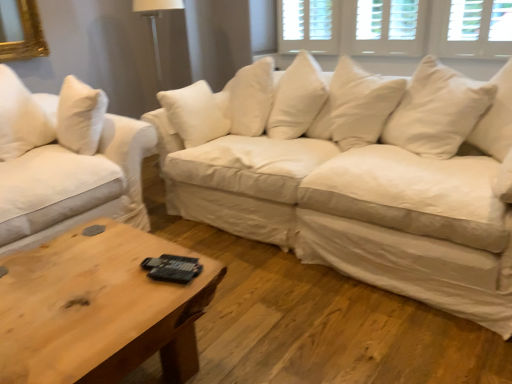
Locate an element on the screen. This screenshot has width=512, height=384. white wood blinds at upper center, the 1th window in the right-to-left sequence is located at coordinates (384, 27).

This screenshot has height=384, width=512. What do you see at coordinates (66, 162) in the screenshot? I see `white cotton couch at left, which is counted as the 2th studio couch, starting from the right` at bounding box center [66, 162].

What are the coordinates of `white cotton couch at center, which is counted as the 1th studio couch, starting from the right` in the screenshot? It's located at (360, 178).

How much space does white cotton couch at center, the 2th studio couch when ordered from left to right, occupy vertically?

It is 31.88 inches.

What do you see at coordinates (98, 308) in the screenshot? I see `wooden rustic coffee table at center` at bounding box center [98, 308].

I want to click on white wood window at upper center, the second window when ordered from right to left, so click(x=308, y=26).

Is white wood window at upper center, the second window when ordered from right to left, looking in the opposite direction of white cotton couch at left, which is counted as the 2th studio couch, starting from the right?

That's not correct — white wood window at upper center, the second window when ordered from right to left, is not looking away from white cotton couch at left, which is counted as the 2th studio couch, starting from the right.

Is point (332, 42) positioned in front of point (6, 240)?

No, (332, 42) is behind (6, 240).

Which object is wider, white wood window at upper center, the second window when ordered from right to left, or white cotton couch at left, the 1th studio couch in the left-to-right sequence?

white cotton couch at left, the 1th studio couch in the left-to-right sequence, is wider.

From their relative heights in the image, would you say white wood window at upper center, the second window when ordered from right to left, is taller or shorter than white cotton couch at left, the 1th studio couch in the left-to-right sequence?

Clearly, white wood window at upper center, the second window when ordered from right to left, is shorter compared to white cotton couch at left, the 1th studio couch in the left-to-right sequence.

From a real-world perspective, who is located higher, white wood blinds at upper center, the 1th window in the right-to-left sequence, or white cotton couch at center, which is counted as the 1th studio couch, starting from the right?

white wood blinds at upper center, the 1th window in the right-to-left sequence, from a real-world perspective.

Choose the correct answer: Is white wood blinds at upper center, which ranks as the second window in left-to-right order, inside white cotton couch at center, which is counted as the 1th studio couch, starting from the right, or outside it?

white wood blinds at upper center, which ranks as the second window in left-to-right order, is not inside white cotton couch at center, which is counted as the 1th studio couch, starting from the right, it's outside.

From the image's perspective, is white wood blinds at upper center, which ranks as the second window in left-to-right order, located above or below white cotton couch at center, the 2th studio couch when ordered from left to right?

Clearly, from the image's perspective, white wood blinds at upper center, which ranks as the second window in left-to-right order, is above white cotton couch at center, the 2th studio couch when ordered from left to right.

Visually, is white cotton couch at center, the 2th studio couch when ordered from left to right, positioned to the left or to the right of white wood window at upper center, the first window from the left?

white cotton couch at center, the 2th studio couch when ordered from left to right, is positioned on white wood window at upper center, the first window from the left,'s left side.

This screenshot has width=512, height=384. Find the location of `the 2nd window above the white cotton couch at center, which is counted as the 1th studio couch, starting from the right (from a real-world perspective)`. the 2nd window above the white cotton couch at center, which is counted as the 1th studio couch, starting from the right (from a real-world perspective) is located at coordinates (308, 26).

From a real-world perspective, who is located lower, white cotton couch at center, which is counted as the 1th studio couch, starting from the right, or white wood window at upper center, the first window from the left?

From a 3D spatial view, white cotton couch at center, which is counted as the 1th studio couch, starting from the right, is below.

Does white cotton couch at left, the 1th studio couch in the left-to-right sequence, have a smaller size compared to white wood window at upper center, the second window when ordered from right to left?

Incorrect, white cotton couch at left, the 1th studio couch in the left-to-right sequence, is not smaller in size than white wood window at upper center, the second window when ordered from right to left.

Considering the relative sizes of white cotton couch at left, which is counted as the 2th studio couch, starting from the right, and white wood window at upper center, the first window from the left, in the image provided, is white cotton couch at left, which is counted as the 2th studio couch, starting from the right, taller than white wood window at upper center, the first window from the left,?

Yes.

At what (x,y) coordinates should I click in order to perform the action: click on the 2nd window behind the white cotton couch at left, the 1th studio couch in the left-to-right sequence. Please return your answer as a coordinate pair (x, y). Looking at the image, I should click on (308, 26).

Is white cotton couch at left, which is counted as the 2th studio couch, starting from the right, oriented away from white wood window at upper center, the first window from the left?

white cotton couch at left, which is counted as the 2th studio couch, starting from the right, is not turned away from white wood window at upper center, the first window from the left.

Can you tell me how much white wood window at upper center, the first window from the left, and wooden rustic coffee table at center differ in facing direction?

90 degrees.

From the image's perspective, is white wood window at upper center, the first window from the left, located above or below wooden rustic coffee table at center?

white wood window at upper center, the first window from the left, is situated higher than wooden rustic coffee table at center in the image.

The image size is (512, 384). In the image, there is a white wood window at upper center, the first window from the left. Identify the location of coffee table below it (from a real-world perspective). (98, 308).

Is white wood window at upper center, the first window from the left, wider than wooden rustic coffee table at center?

In fact, white wood window at upper center, the first window from the left, might be narrower than wooden rustic coffee table at center.

Based on the photo, is white cotton couch at center, which is counted as the 1th studio couch, starting from the right, positioned in front of white cotton couch at left, which is counted as the 2th studio couch, starting from the right?

Yes, white cotton couch at center, which is counted as the 1th studio couch, starting from the right, is in front of white cotton couch at left, which is counted as the 2th studio couch, starting from the right.

Which object is wider, white cotton couch at center, which is counted as the 1th studio couch, starting from the right, or white cotton couch at left, which is counted as the 2th studio couch, starting from the right?

With larger width is white cotton couch at left, which is counted as the 2th studio couch, starting from the right.

Would you say white cotton couch at center, which is counted as the 1th studio couch, starting from the right, is outside white cotton couch at left, the 1th studio couch in the left-to-right sequence?

Yes, white cotton couch at center, which is counted as the 1th studio couch, starting from the right, is located beyond the bounds of white cotton couch at left, the 1th studio couch in the left-to-right sequence.

Consider the image. Is white cotton couch at center, which is counted as the 1th studio couch, starting from the right, aimed at white cotton couch at left, the 1th studio couch in the left-to-right sequence?

Yes.

Looking at this image, is white cotton couch at center, which is counted as the 1th studio couch, starting from the right, taller or shorter than wooden rustic coffee table at center?

Considering their sizes, white cotton couch at center, which is counted as the 1th studio couch, starting from the right, has more height than wooden rustic coffee table at center.

Which object is wider, white cotton couch at center, the 2th studio couch when ordered from left to right, or wooden rustic coffee table at center?

white cotton couch at center, the 2th studio couch when ordered from left to right, is wider.

Does white cotton couch at center, the 2th studio couch when ordered from left to right, turn towards wooden rustic coffee table at center?

Yes, white cotton couch at center, the 2th studio couch when ordered from left to right, is facing wooden rustic coffee table at center.

This screenshot has width=512, height=384. Find the location of `window that is the 2nd object located above the white cotton couch at left, which is counted as the 2th studio couch, starting from the right (from the image's perspective)`. window that is the 2nd object located above the white cotton couch at left, which is counted as the 2th studio couch, starting from the right (from the image's perspective) is located at coordinates pyautogui.click(x=308, y=26).

Find the location of a particular element. This screenshot has height=384, width=512. studio couch that is the 1st one when counting downward from the white wood blinds at upper center, the 1th window in the right-to-left sequence (from the image's perspective) is located at coordinates (360, 178).

Based on their spatial positions, is white wood window at upper center, the second window when ordered from right to left, or white cotton couch at center, which is counted as the 1th studio couch, starting from the right, closer to white cotton couch at left, the 1th studio couch in the left-to-right sequence?

white cotton couch at center, which is counted as the 1th studio couch, starting from the right, is positioned closer to the anchor white cotton couch at left, the 1th studio couch in the left-to-right sequence.

Which object lies nearer to the anchor point wooden rustic coffee table at center, white wood blinds at upper center, the 1th window in the right-to-left sequence, or white cotton couch at left, the 1th studio couch in the left-to-right sequence?

white cotton couch at left, the 1th studio couch in the left-to-right sequence, is closer to wooden rustic coffee table at center.

Looking at the image, which one is located further to white cotton couch at center, which is counted as the 1th studio couch, starting from the right, wooden rustic coffee table at center or white wood blinds at upper center, which ranks as the second window in left-to-right order?

white wood blinds at upper center, which ranks as the second window in left-to-right order, is further to white cotton couch at center, which is counted as the 1th studio couch, starting from the right.

Consider the image. Estimate the real-world distances between objects in this image. Which object is further from wooden rustic coffee table at center, white wood blinds at upper center, the 1th window in the right-to-left sequence, or white wood window at upper center, the second window when ordered from right to left?

white wood window at upper center, the second window when ordered from right to left, is positioned further to the anchor wooden rustic coffee table at center.

Based on their spatial positions, is white wood blinds at upper center, which ranks as the second window in left-to-right order, or wooden rustic coffee table at center further from white cotton couch at left, the 1th studio couch in the left-to-right sequence?

white wood blinds at upper center, which ranks as the second window in left-to-right order, is further to white cotton couch at left, the 1th studio couch in the left-to-right sequence.

Looking at the image, which one is located further to white cotton couch at left, which is counted as the 2th studio couch, starting from the right, wooden rustic coffee table at center or white wood blinds at upper center, the 1th window in the right-to-left sequence?

The object further to white cotton couch at left, which is counted as the 2th studio couch, starting from the right, is white wood blinds at upper center, the 1th window in the right-to-left sequence.

From the image, which object appears to be farther from white cotton couch at center, which is counted as the 1th studio couch, starting from the right, white wood window at upper center, the first window from the left, or wooden rustic coffee table at center?

white wood window at upper center, the first window from the left, is further to white cotton couch at center, which is counted as the 1th studio couch, starting from the right.

Based on the photo, when comparing their distances from white cotton couch at center, the 2th studio couch when ordered from left to right, does white wood blinds at upper center, the 1th window in the right-to-left sequence, or white cotton couch at left, the 1th studio couch in the left-to-right sequence, seem further?

The object further to white cotton couch at center, the 2th studio couch when ordered from left to right, is white wood blinds at upper center, the 1th window in the right-to-left sequence.

Locate an element on the screen. coffee table between white cotton couch at left, which is counted as the 2th studio couch, starting from the right, and white wood blinds at upper center, the 1th window in the right-to-left sequence, in the horizontal direction is located at coordinates (98, 308).

You are a GUI agent. You are given a task and a screenshot of the screen. Output one action in this format:
    pyautogui.click(x=<x>, y=<y>)
    Task: Click on the studio couch positioned between white cotton couch at center, the 2th studio couch when ordered from left to right, and white wood window at upper center, the second window when ordered from right to left, from near to far
    The image size is (512, 384).
    Given the screenshot: What is the action you would take?
    pyautogui.click(x=66, y=162)

Where is `coffee table between white cotton couch at left, the 1th studio couch in the left-to-right sequence, and white cotton couch at center, the 2th studio couch when ordered from left to right, in the horizontal direction`? Image resolution: width=512 pixels, height=384 pixels. coffee table between white cotton couch at left, the 1th studio couch in the left-to-right sequence, and white cotton couch at center, the 2th studio couch when ordered from left to right, in the horizontal direction is located at coordinates (98, 308).

At what (x,y) coordinates should I click in order to perform the action: click on studio couch between white cotton couch at left, the 1th studio couch in the left-to-right sequence, and white wood blinds at upper center, which ranks as the second window in left-to-right order. Please return your answer as a coordinate pair (x, y). Image resolution: width=512 pixels, height=384 pixels. Looking at the image, I should click on (360, 178).